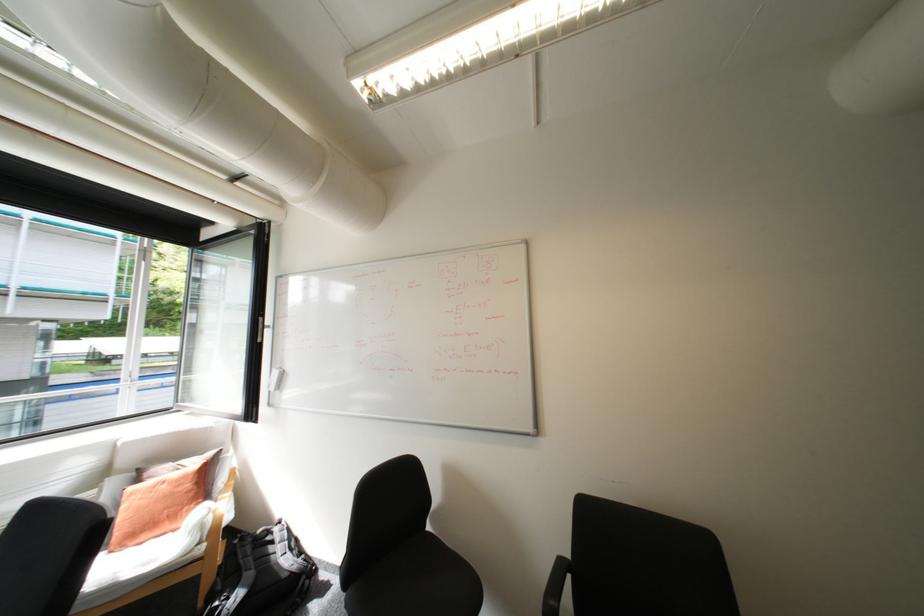
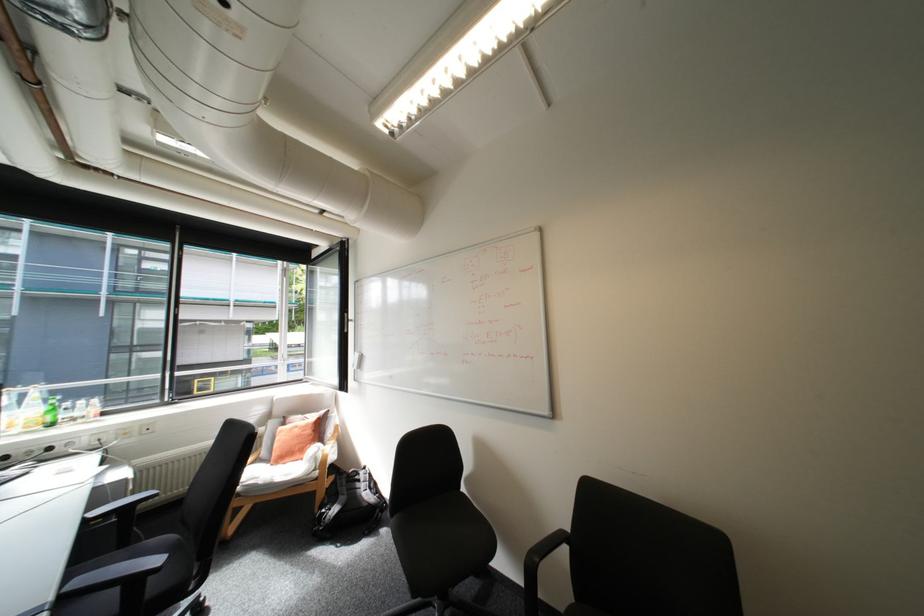
The point at (x=175, y=485) is marked in the first image. Where is the corresponding point in the second image?

(307, 429)